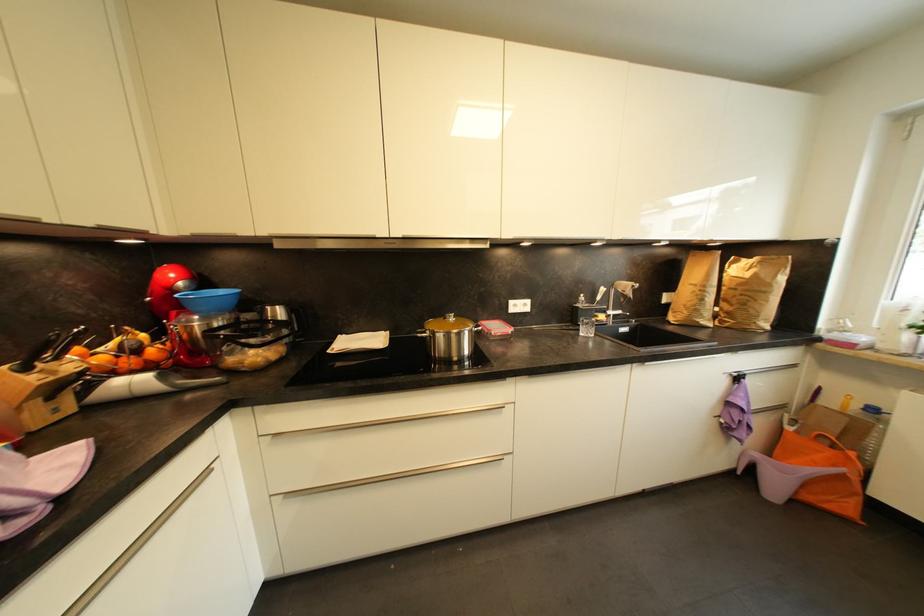
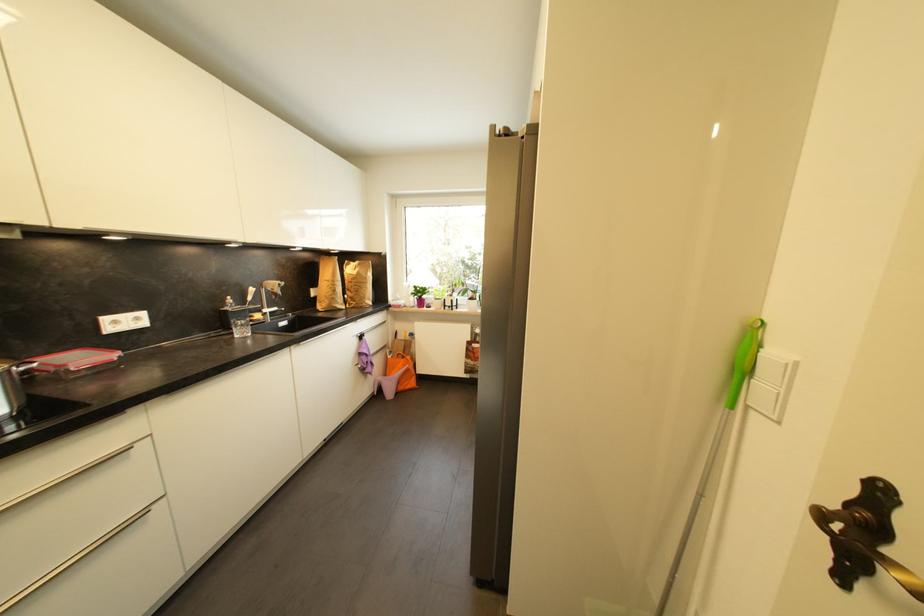
Where in the second image is the point corresponding to (x=492, y=322) from the first image?

(54, 355)